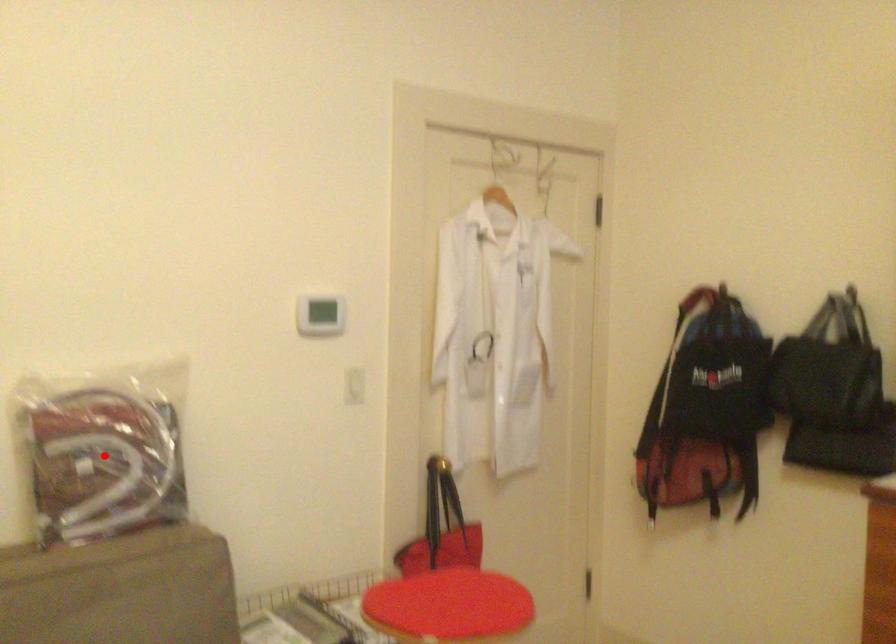
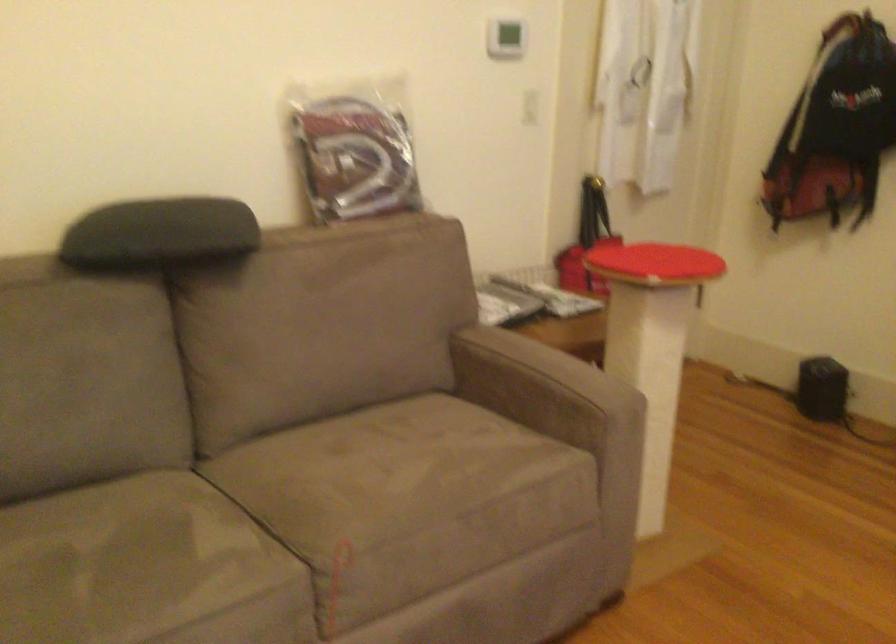
Question: I am providing you with two images of the same scene from different viewpoints. Image1 has a red point marked. In image2, the corresponding 3D location appears at what relative position? Reply with the corresponding letter.

Choices:
 (A) Closer
 (B) Farther

Answer: (B)